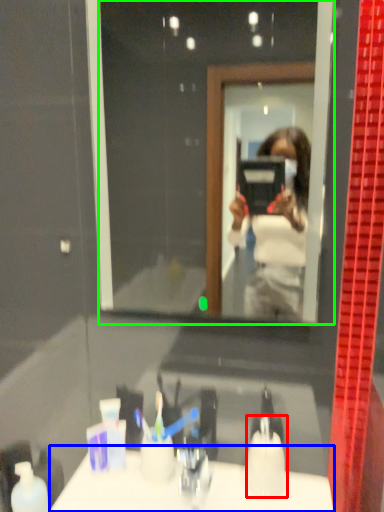
Question: Which object is positioned farthest from toiletry (highlighted by a red box)? Select from counter top (highlighted by a blue box) and mirror (highlighted by a green box).

Choices:
 (A) counter top
 (B) mirror

Answer: (B)